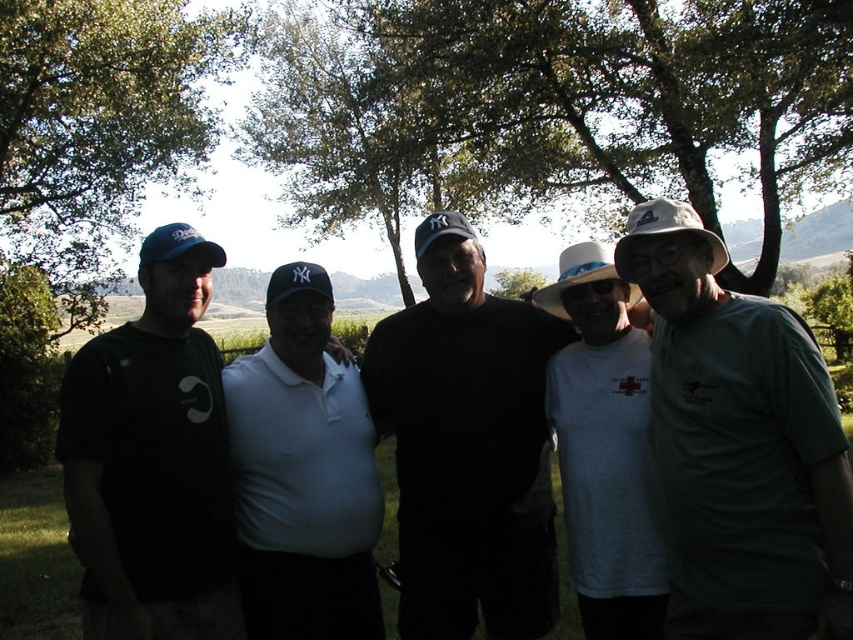
Question: In this image, where is green matte shirt at right located relative to matte black t-shirt at left?

Choices:
 (A) left
 (B) right

Answer: (B)

Question: Which of the following is the farthest from the observer?

Choices:
 (A) (410, 566)
 (B) (466, 227)
 (C) (831, 580)
 (D) (444, 45)

Answer: (D)

Question: Is white matte polo shirt at center thinner than white fabric cowboy hat at right?

Choices:
 (A) yes
 (B) no

Answer: (A)

Question: Which point is farther from the camera taking this photo?

Choices:
 (A) (10, 177)
 (B) (337, 188)
 (C) (508, 355)
 (D) (279, 512)

Answer: (B)

Question: Which object is closer to the camera taking this photo?

Choices:
 (A) matte black t-shirt at left
 (B) green leafy tree at center

Answer: (A)

Question: Can you confirm if white fabric cowboy hat at right is smaller than matte black baseball cap at center?

Choices:
 (A) no
 (B) yes

Answer: (A)